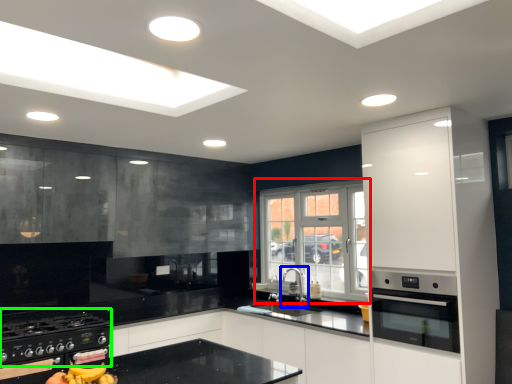
Question: Which object is the closest to the window (highlighted by a red box)? Choose among these: tap (highlighted by a blue box) or gas stove (highlighted by a green box).

Choices:
 (A) tap
 (B) gas stove

Answer: (A)